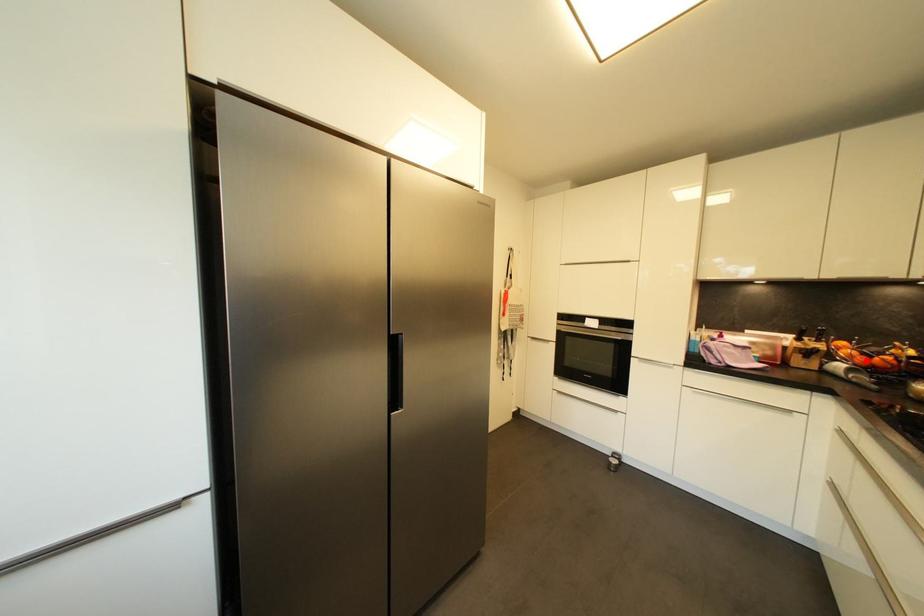
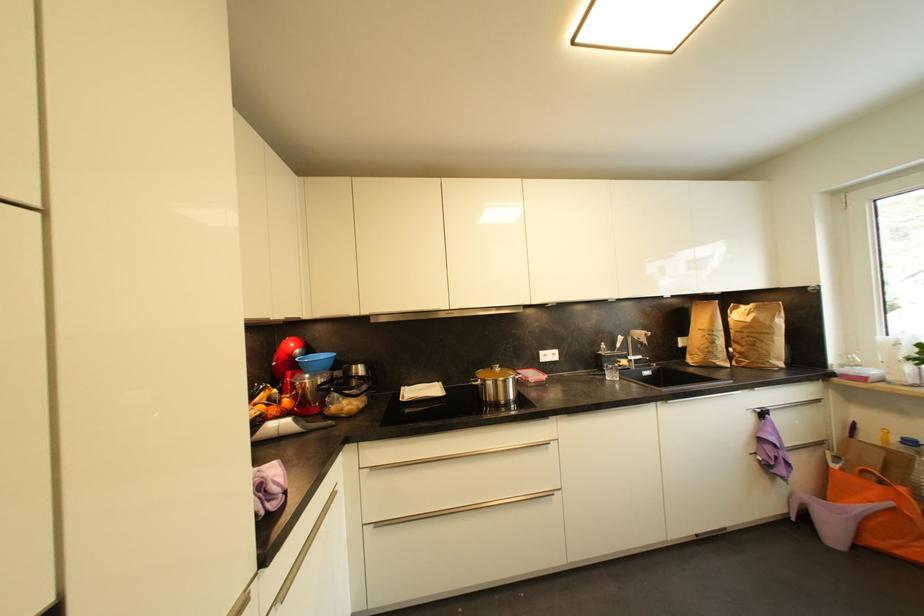
In the second image, find the point that corresponds to the highlighted location in the first image.

(277, 411)